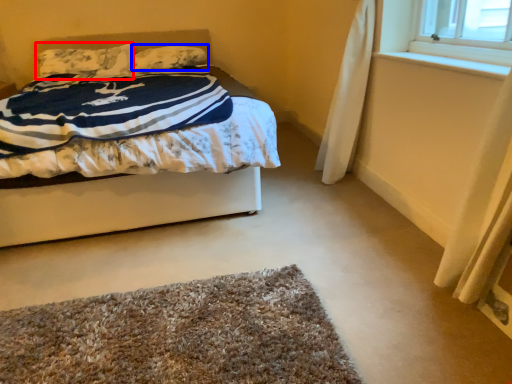
Question: Which object appears closest to the camera in this image, pillow (highlighted by a red box) or pillow (highlighted by a blue box)?

Choices:
 (A) pillow
 (B) pillow

Answer: (A)